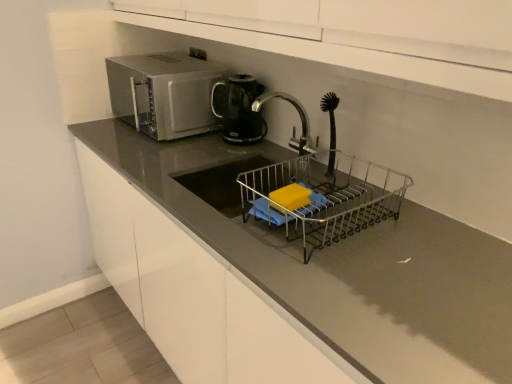
Image resolution: width=512 pixels, height=384 pixels. I want to click on free location to the right of metallic wire dish rack at center, so pos(440,239).